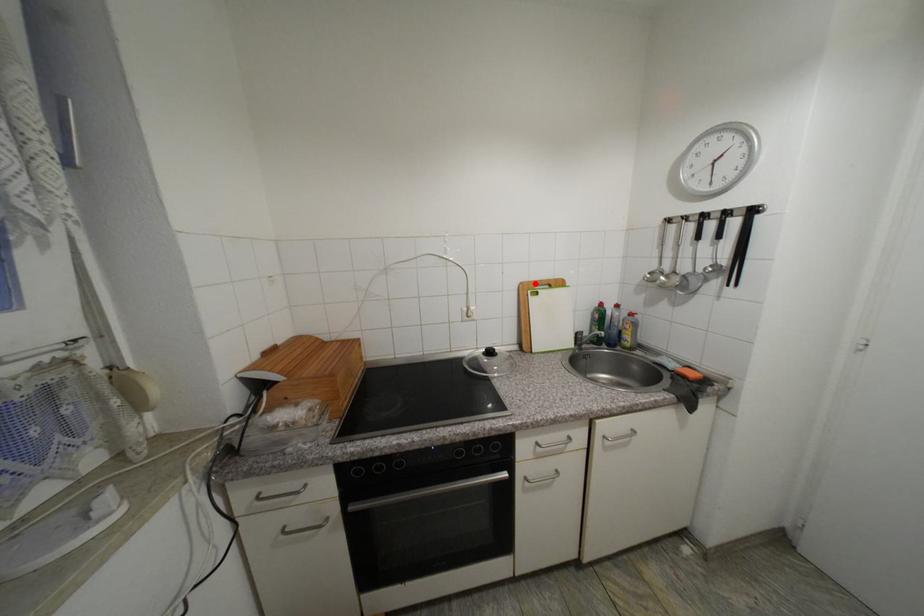
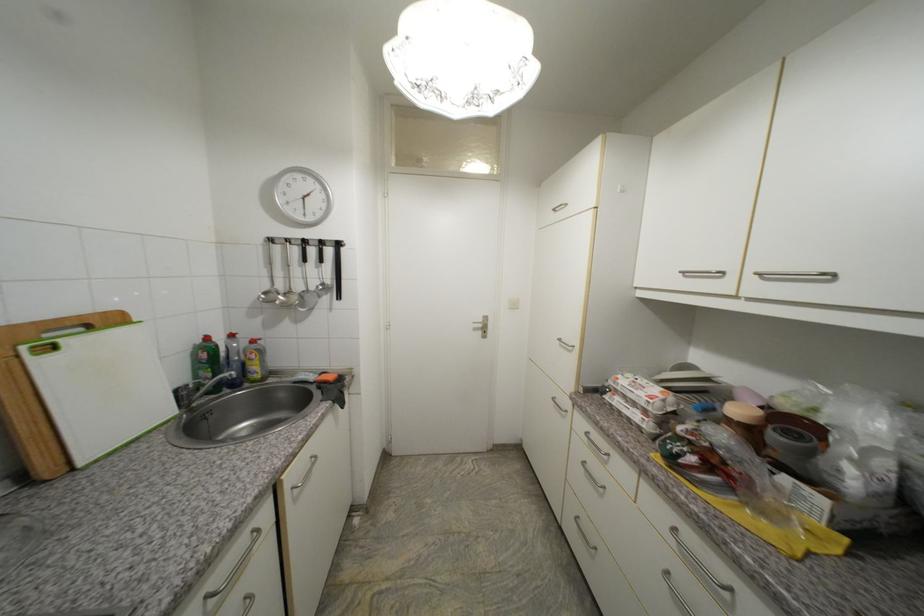
Question: I am providing you with two images of the same scene from different viewpoints. A red point is marked on the first image. At the location where the point appears in image 1, is it still visible in image 2?

Choices:
 (A) Yes
 (B) No

Answer: (A)